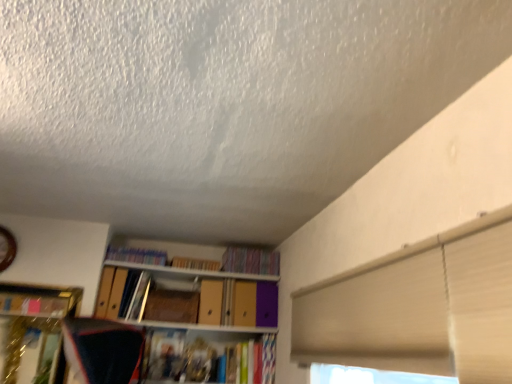
Locate an element on the screen. This screenshot has width=512, height=384. wooden paperback book at center is located at coordinates (172, 306).

Describe the element at coordinates (136, 255) in the screenshot. Image resolution: width=512 pixels, height=384 pixels. I see `matte plastic books at upper center, arranged as the 1th book when viewed from the left` at that location.

Where is `multicolored fabric book at upper center, marked as the third book in a left-to-right arrangement`? The height and width of the screenshot is (384, 512). multicolored fabric book at upper center, marked as the third book in a left-to-right arrangement is located at coordinates (251, 261).

Locate an element on the screen. The height and width of the screenshot is (384, 512). wooden paperback book at center is located at coordinates (172, 306).

Could you tell me if multicolored fabric book at upper center, marked as the 1th book in a right-to-left arrangement, is turned towards wooden paperback book at center?

No, multicolored fabric book at upper center, marked as the 1th book in a right-to-left arrangement, is not facing towards wooden paperback book at center.

Considering the points (233, 246) and (143, 318), which point is in front, point (233, 246) or point (143, 318)?

Positioned in front is point (143, 318).

How different are the orientations of multicolored fabric book at upper center, marked as the 1th book in a right-to-left arrangement, and wooden paperback book at center in degrees?

Answer: 8.21 degrees separate the facing orientations of multicolored fabric book at upper center, marked as the 1th book in a right-to-left arrangement, and wooden paperback book at center.

Who is smaller, multicolored fabric book at upper center, marked as the 1th book in a right-to-left arrangement, or wooden paperback book at center?

Smaller between the two is wooden paperback book at center.

Measure the distance from matte cardboard book at upper center, positioned as the 2th book in left-to-right order, to multicolored fabric book at upper center, marked as the 1th book in a right-to-left arrangement.

A distance of 21.16 centimeters exists between matte cardboard book at upper center, positioned as the 2th book in left-to-right order, and multicolored fabric book at upper center, marked as the 1th book in a right-to-left arrangement.

Looking at this image, is matte cardboard book at upper center, positioned as the 2th book in left-to-right order, taller or shorter than multicolored fabric book at upper center, marked as the third book in a left-to-right arrangement?

Considering their sizes, matte cardboard book at upper center, positioned as the 2th book in left-to-right order, has less height than multicolored fabric book at upper center, marked as the third book in a left-to-right arrangement.

Which of these two, matte cardboard book at upper center, arranged as the 2th book when viewed from the right, or multicolored fabric book at upper center, marked as the 1th book in a right-to-left arrangement, is bigger?

With larger size is multicolored fabric book at upper center, marked as the 1th book in a right-to-left arrangement.

Which object is thinner, matte cardboard book at upper center, positioned as the 2th book in left-to-right order, or multicolored fabric book at upper center, marked as the third book in a left-to-right arrangement?

With smaller width is matte cardboard book at upper center, positioned as the 2th book in left-to-right order.

Is matte cardboard book at upper center, positioned as the 2th book in left-to-right order, inside or outside of matte plastic books at upper center, arranged as the 1th book when viewed from the left?

matte cardboard book at upper center, positioned as the 2th book in left-to-right order, is located beyond the bounds of matte plastic books at upper center, arranged as the 1th book when viewed from the left.

From a real-world perspective, relative to matte plastic books at upper center, arranged as the 3th book when viewed from the right, is matte cardboard book at upper center, arranged as the 2th book when viewed from the right, vertically above or below?

matte cardboard book at upper center, arranged as the 2th book when viewed from the right, is below matte plastic books at upper center, arranged as the 3th book when viewed from the right.

From the image's perspective, which one is positioned higher, matte cardboard book at upper center, positioned as the 2th book in left-to-right order, or matte plastic books at upper center, arranged as the 3th book when viewed from the right?

From the image's view, matte plastic books at upper center, arranged as the 3th book when viewed from the right, is above.

Can you confirm if matte cardboard book at upper center, positioned as the 2th book in left-to-right order, is wider than matte plastic books at upper center, arranged as the 1th book when viewed from the left?

Correct, the width of matte cardboard book at upper center, positioned as the 2th book in left-to-right order, exceeds that of matte plastic books at upper center, arranged as the 1th book when viewed from the left.

Is wooden paperback book at center taller or shorter than matte cardboard book at upper center, arranged as the 2th book when viewed from the right?

Considering their sizes, wooden paperback book at center has more height than matte cardboard book at upper center, arranged as the 2th book when viewed from the right.

From the picture: Measure the distance between wooden paperback book at center and matte cardboard book at upper center, positioned as the 2th book in left-to-right order.

wooden paperback book at center is 24.62 centimeters away from matte cardboard book at upper center, positioned as the 2th book in left-to-right order.

Is wooden paperback book at center not inside matte cardboard book at upper center, positioned as the 2th book in left-to-right order?

Yes, wooden paperback book at center is not within matte cardboard book at upper center, positioned as the 2th book in left-to-right order.

Considering the positions of points (197, 317) and (218, 267), is point (197, 317) closer to camera compared to point (218, 267)?

Yes, it is.

Considering the sizes of objects wooden paperback book at center and multicolored fabric book at upper center, marked as the 1th book in a right-to-left arrangement, in the image provided, who is thinner, wooden paperback book at center or multicolored fabric book at upper center, marked as the 1th book in a right-to-left arrangement,?

With smaller width is wooden paperback book at center.

Would you consider wooden paperback book at center to be distant from multicolored fabric book at upper center, marked as the third book in a left-to-right arrangement?

No, wooden paperback book at center is not far from multicolored fabric book at upper center, marked as the third book in a left-to-right arrangement.

Based on the photo, from the image's perspective, which is above, wooden paperback book at center or multicolored fabric book at upper center, marked as the 1th book in a right-to-left arrangement?

multicolored fabric book at upper center, marked as the 1th book in a right-to-left arrangement.

Is multicolored fabric book at upper center, marked as the third book in a left-to-right arrangement, a part of matte plastic books at upper center, arranged as the 3th book when viewed from the right?

No.

In terms of height, does matte plastic books at upper center, arranged as the 1th book when viewed from the left, look taller or shorter compared to multicolored fabric book at upper center, marked as the 1th book in a right-to-left arrangement?

matte plastic books at upper center, arranged as the 1th book when viewed from the left, is shorter than multicolored fabric book at upper center, marked as the 1th book in a right-to-left arrangement.

Is matte plastic books at upper center, arranged as the 3th book when viewed from the right, facing towards multicolored fabric book at upper center, marked as the third book in a left-to-right arrangement?

No, matte plastic books at upper center, arranged as the 3th book when viewed from the right, does not turn towards multicolored fabric book at upper center, marked as the third book in a left-to-right arrangement.

Considering the sizes of matte cardboard book at upper center, positioned as the 2th book in left-to-right order, and wooden paperback book at center in the image, is matte cardboard book at upper center, positioned as the 2th book in left-to-right order, wider or thinner than wooden paperback book at center?

matte cardboard book at upper center, positioned as the 2th book in left-to-right order, is thinner than wooden paperback book at center.

Where is `paperback book below the matte cardboard book at upper center, positioned as the 2th book in left-to-right order (from the image's perspective)`? The height and width of the screenshot is (384, 512). paperback book below the matte cardboard book at upper center, positioned as the 2th book in left-to-right order (from the image's perspective) is located at coordinates (172, 306).

Considering the sizes of objects matte cardboard book at upper center, arranged as the 2th book when viewed from the right, and wooden paperback book at center in the image provided, who is bigger, matte cardboard book at upper center, arranged as the 2th book when viewed from the right, or wooden paperback book at center?

wooden paperback book at center.

Is matte cardboard book at upper center, positioned as the 2th book in left-to-right order, positioned far away from wooden paperback book at center?

No, matte cardboard book at upper center, positioned as the 2th book in left-to-right order, is not far from wooden paperback book at center.

Find the location of a particular element. paperback book on the left of multicolored fabric book at upper center, marked as the 1th book in a right-to-left arrangement is located at coordinates (172, 306).

Find the location of a particular element. book lying on the right of matte cardboard book at upper center, positioned as the 2th book in left-to-right order is located at coordinates (251, 261).

Looking at this image, from the image, which object appears to be farther from matte cardboard book at upper center, positioned as the 2th book in left-to-right order, multicolored fabric book at upper center, marked as the third book in a left-to-right arrangement, or wooden paperback book at center?

wooden paperback book at center lies further to matte cardboard book at upper center, positioned as the 2th book in left-to-right order, than the other object.

When comparing their distances from matte plastic books at upper center, arranged as the 3th book when viewed from the right, does matte cardboard book at upper center, positioned as the 2th book in left-to-right order, or wooden paperback book at center seem further?

Among the two, wooden paperback book at center is located further to matte plastic books at upper center, arranged as the 3th book when viewed from the right.

Based on their spatial positions, is matte cardboard book at upper center, positioned as the 2th book in left-to-right order, or multicolored fabric book at upper center, marked as the third book in a left-to-right arrangement, closer to wooden paperback book at center?

matte cardboard book at upper center, positioned as the 2th book in left-to-right order.

Based on the photo, from the image, which object appears to be farther from multicolored fabric book at upper center, marked as the third book in a left-to-right arrangement, matte plastic books at upper center, arranged as the 3th book when viewed from the right, or wooden paperback book at center?

Based on the image, matte plastic books at upper center, arranged as the 3th book when viewed from the right, appears to be further to multicolored fabric book at upper center, marked as the third book in a left-to-right arrangement.

Which object lies nearer to the anchor point wooden paperback book at center, multicolored fabric book at upper center, marked as the 1th book in a right-to-left arrangement, or matte plastic books at upper center, arranged as the 3th book when viewed from the right?

matte plastic books at upper center, arranged as the 3th book when viewed from the right, is closer to wooden paperback book at center.

Estimate the real-world distances between objects in this image. Which object is further from matte plastic books at upper center, arranged as the 1th book when viewed from the left, matte cardboard book at upper center, arranged as the 2th book when viewed from the right, or multicolored fabric book at upper center, marked as the third book in a left-to-right arrangement?

The object further to matte plastic books at upper center, arranged as the 1th book when viewed from the left, is multicolored fabric book at upper center, marked as the third book in a left-to-right arrangement.

Which object lies further to the anchor point wooden paperback book at center, multicolored fabric book at upper center, marked as the third book in a left-to-right arrangement, or matte cardboard book at upper center, arranged as the 2th book when viewed from the right?

Based on the image, multicolored fabric book at upper center, marked as the third book in a left-to-right arrangement, appears to be further to wooden paperback book at center.

From the image, which object appears to be nearer to multicolored fabric book at upper center, marked as the third book in a left-to-right arrangement, matte cardboard book at upper center, positioned as the 2th book in left-to-right order, or matte plastic books at upper center, arranged as the 1th book when viewed from the left?

matte cardboard book at upper center, positioned as the 2th book in left-to-right order, lies closer to multicolored fabric book at upper center, marked as the third book in a left-to-right arrangement, than the other object.

Where is `paperback book situated between matte plastic books at upper center, arranged as the 1th book when viewed from the left, and multicolored fabric book at upper center, marked as the 1th book in a right-to-left arrangement, from left to right`? This screenshot has width=512, height=384. paperback book situated between matte plastic books at upper center, arranged as the 1th book when viewed from the left, and multicolored fabric book at upper center, marked as the 1th book in a right-to-left arrangement, from left to right is located at coordinates (172, 306).

Where is `book between wooden paperback book at center and multicolored fabric book at upper center, marked as the third book in a left-to-right arrangement`? The image size is (512, 384). book between wooden paperback book at center and multicolored fabric book at upper center, marked as the third book in a left-to-right arrangement is located at coordinates (195, 263).

Find the location of a particular element. book located between matte plastic books at upper center, arranged as the 1th book when viewed from the left, and multicolored fabric book at upper center, marked as the 1th book in a right-to-left arrangement, in the left-right direction is located at coordinates (195, 263).

Where is `paperback book located between matte plastic books at upper center, arranged as the 1th book when viewed from the left, and matte cardboard book at upper center, arranged as the 2th book when viewed from the right, in the left-right direction`? This screenshot has width=512, height=384. paperback book located between matte plastic books at upper center, arranged as the 1th book when viewed from the left, and matte cardboard book at upper center, arranged as the 2th book when viewed from the right, in the left-right direction is located at coordinates (172, 306).